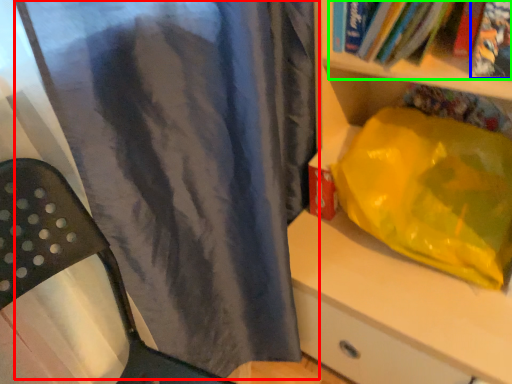
Question: Which is nearer to the curtain (highlighted by a red box)? book (highlighted by a blue box) or book (highlighted by a green box).

Choices:
 (A) book
 (B) book

Answer: (B)